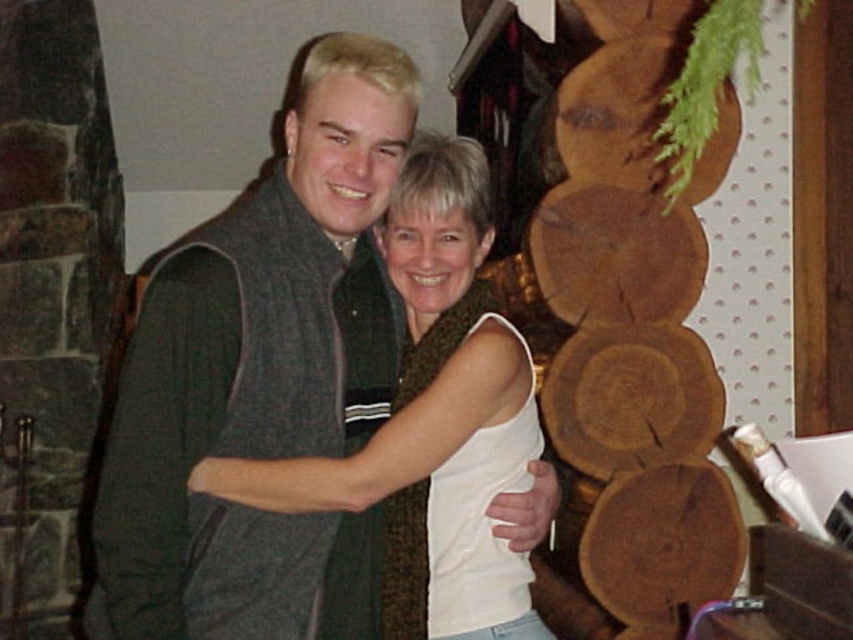
Between dark gray sweater vest at center and white textured tank top at center, which one is positioned higher?

dark gray sweater vest at center

Is point (263, 310) farther from camera compared to point (427, 278)?

No, (263, 310) is closer to viewer.

Locate an element on the screen. dark gray sweater vest at center is located at coordinates (262, 378).